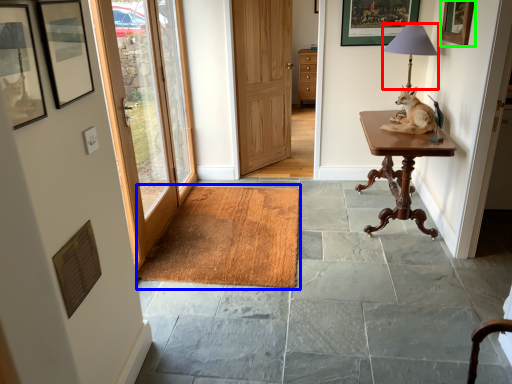
Question: Considering the real-world distances, which object is closest to table lamp (highlighted by a red box)? doormat (highlighted by a blue box) or picture frame (highlighted by a green box).

Choices:
 (A) doormat
 (B) picture frame

Answer: (B)